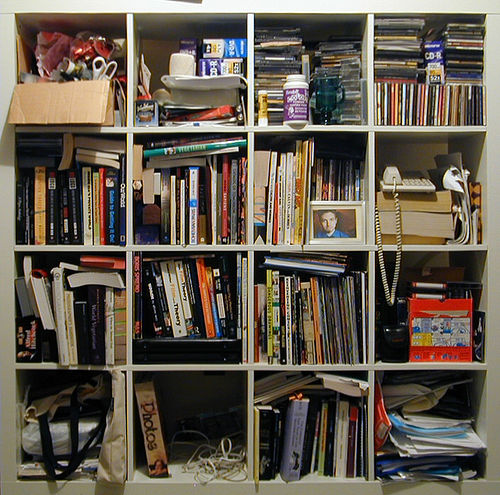
The width and height of the screenshot is (500, 495). I want to click on rows of shelves, so click(x=210, y=478), click(x=218, y=365), click(x=239, y=242), click(x=241, y=128).